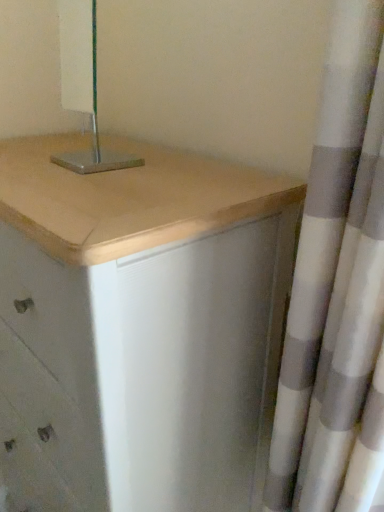
Question: From the image's perspective, would you say metallic silver lamp at upper center is shown under matte white chest of drawers at center?

Choices:
 (A) yes
 (B) no

Answer: (B)

Question: Can you confirm if metallic silver lamp at upper center is wider than matte white chest of drawers at center?

Choices:
 (A) no
 (B) yes

Answer: (A)

Question: Considering the relative sizes of metallic silver lamp at upper center and matte white chest of drawers at center in the image provided, is metallic silver lamp at upper center bigger than matte white chest of drawers at center?

Choices:
 (A) yes
 (B) no

Answer: (B)

Question: From a real-world perspective, is metallic silver lamp at upper center located beneath matte white chest of drawers at center?

Choices:
 (A) no
 (B) yes

Answer: (A)

Question: Does metallic silver lamp at upper center have a greater height compared to matte white chest of drawers at center?

Choices:
 (A) no
 (B) yes

Answer: (A)

Question: From the image's perspective, is white textured curtain at right positioned above or below matte white chest of drawers at center?

Choices:
 (A) below
 (B) above

Answer: (B)

Question: Is white textured curtain at right wider or thinner than matte white chest of drawers at center?

Choices:
 (A) wide
 (B) thin

Answer: (B)

Question: Which is correct: white textured curtain at right is inside matte white chest of drawers at center, or outside of it?

Choices:
 (A) outside
 (B) inside

Answer: (A)

Question: In the image, is white textured curtain at right on the left side or the right side of matte white chest of drawers at center?

Choices:
 (A) right
 (B) left

Answer: (A)

Question: Would you say matte white chest of drawers at center is to the left or to the right of white textured curtain at right in the picture?

Choices:
 (A) left
 (B) right

Answer: (A)

Question: Do you think matte white chest of drawers at center is within white textured curtain at right, or outside of it?

Choices:
 (A) outside
 (B) inside

Answer: (A)

Question: In terms of width, does matte white chest of drawers at center look wider or thinner when compared to white textured curtain at right?

Choices:
 (A) wide
 (B) thin

Answer: (A)

Question: From a real-world perspective, is matte white chest of drawers at center positioned above or below white textured curtain at right?

Choices:
 (A) below
 (B) above

Answer: (A)

Question: In terms of height, does matte white chest of drawers at center look taller or shorter compared to metallic silver lamp at upper center?

Choices:
 (A) tall
 (B) short

Answer: (A)

Question: From the image's perspective, is matte white chest of drawers at center above or below metallic silver lamp at upper center?

Choices:
 (A) above
 (B) below

Answer: (B)